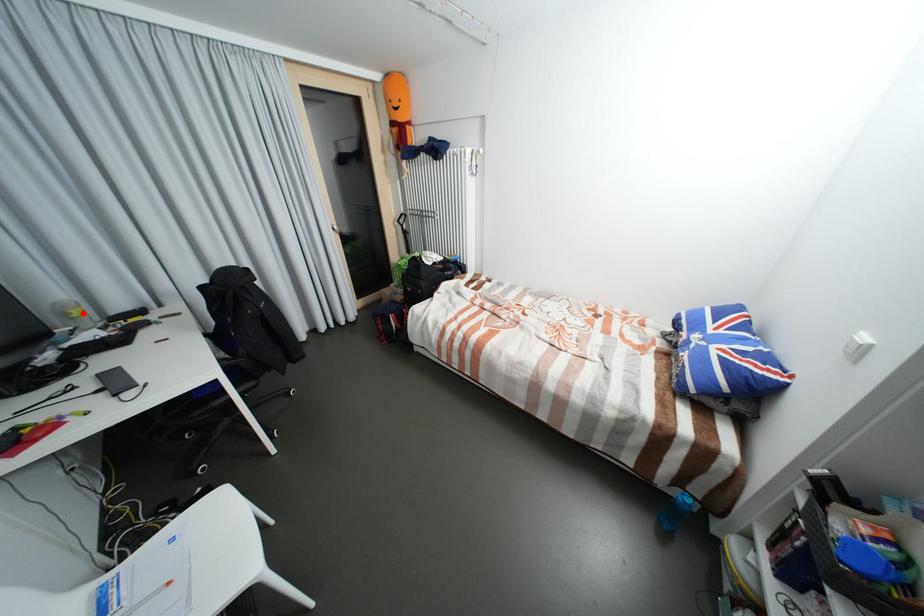
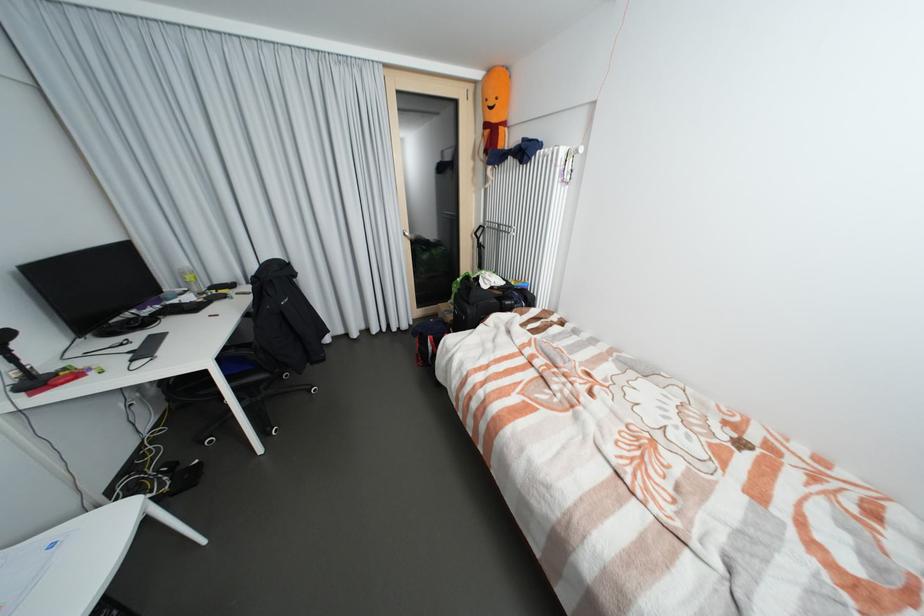
The point at the highlighted location is marked in the first image. Where is the corresponding point in the second image?

(197, 278)